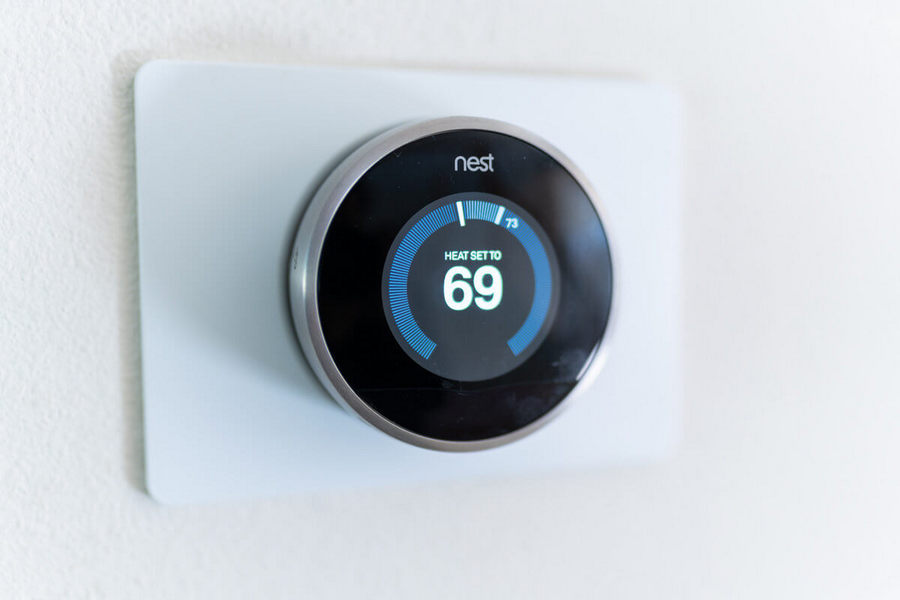
This screenshot has height=600, width=900. Identify the location of led thermostat. (456, 288).